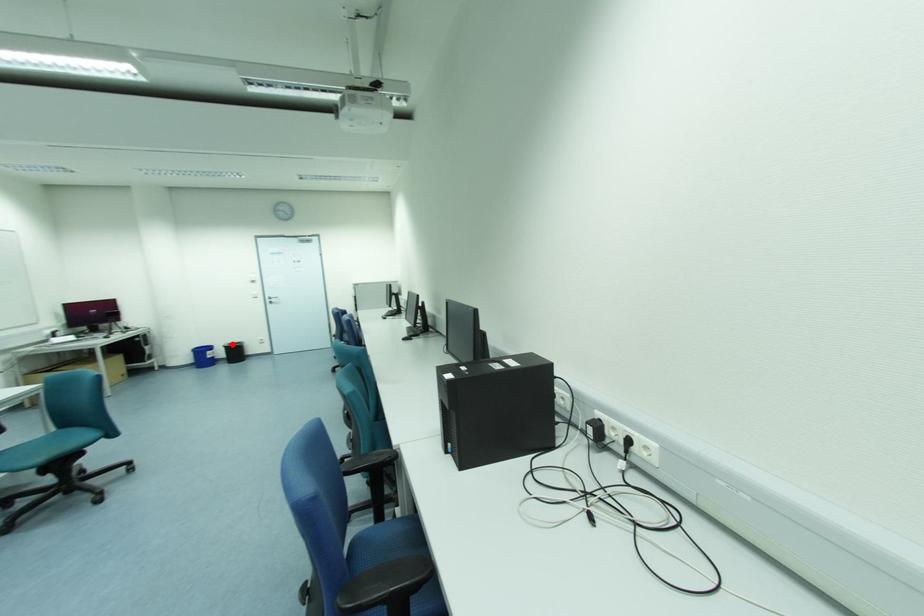
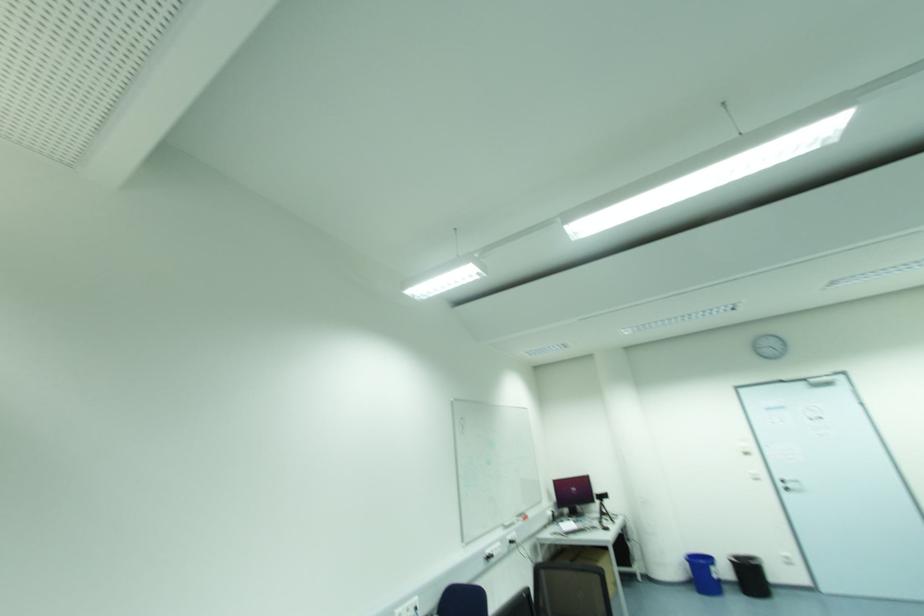
Locate, in the second image, the point that corresponds to the highlighted location in the first image.

(736, 559)